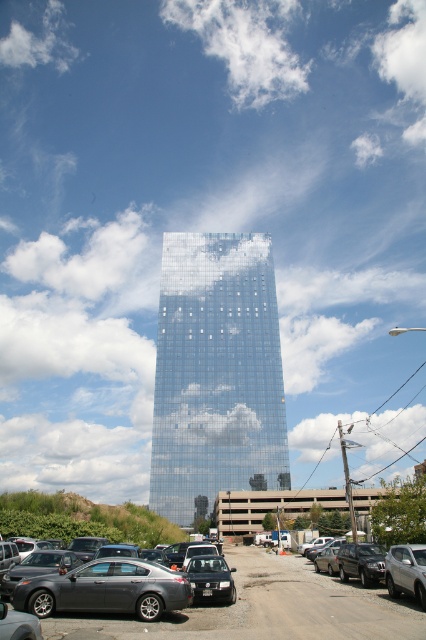
Who is taller, gray matte car at lower left or white fluffy cloud at upper center?

Standing taller between the two is white fluffy cloud at upper center.

Which is below, gray matte car at lower left or white fluffy cloud at upper center?

Positioned lower is gray matte car at lower left.

Locate an element on the screen. gray matte car at lower left is located at coordinates (264, 609).

Image resolution: width=426 pixels, height=640 pixels. What do you see at coordinates (406, 572) in the screenshot?
I see `satin silver sedan at lower right` at bounding box center [406, 572].

Consider the image. Is satin silver sedan at lower right in front of matte black suv at center?

No, satin silver sedan at lower right is further to the viewer.

Is point (399, 564) more distant than point (207, 588)?

Yes, point (399, 564) is behind point (207, 588).

Find the location of `satin silver sedan at lower right`. satin silver sedan at lower right is located at coordinates (406, 572).

The height and width of the screenshot is (640, 426). What do you see at coordinates (245, 44) in the screenshot?
I see `white fluffy cloud at upper center` at bounding box center [245, 44].

I want to click on white fluffy cloud at upper center, so click(245, 44).

Is point (305, 74) farther from viewer compared to point (203, 572)?

Yes.

Find the location of a particular element. white fluffy cloud at upper center is located at coordinates (245, 44).